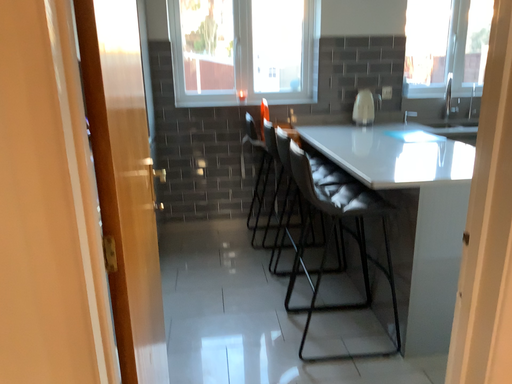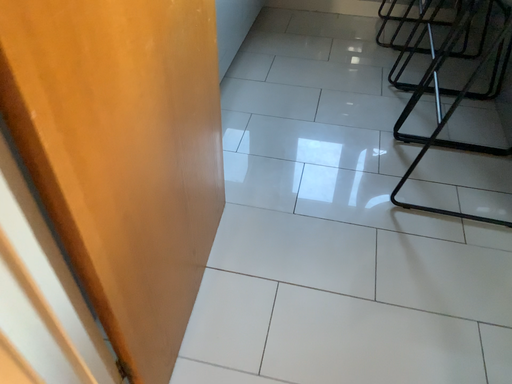
Question: How did the camera likely rotate when shooting the video?

Choices:
 (A) rotated right
 (B) rotated left

Answer: (B)